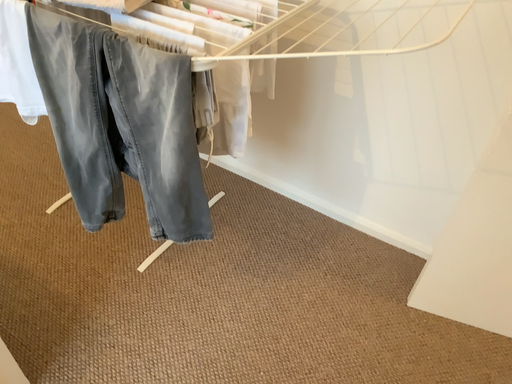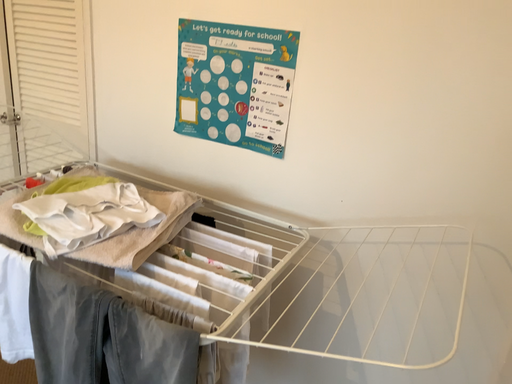
Question: How did the camera likely rotate when shooting the video?

Choices:
 (A) rotated downward
 (B) rotated upward

Answer: (B)